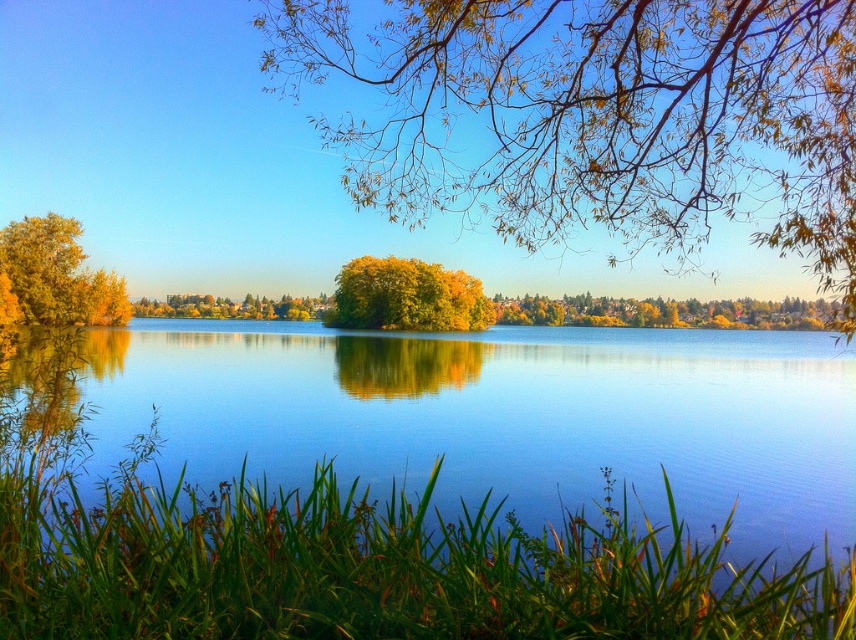
Question: Does green leafy grass at lower center appear over golden leafy tree at center?

Choices:
 (A) no
 (B) yes

Answer: (A)

Question: From the image, what is the correct spatial relationship of golden leafy tree at center in relation to golden yellow leaves at left?

Choices:
 (A) left
 (B) right

Answer: (B)

Question: Which point is closer to the camera?

Choices:
 (A) golden leafy tree at center
 (B) golden yellow leaves at left

Answer: (B)

Question: Among these points, which one is nearest to the camera?

Choices:
 (A) (42, 273)
 (B) (4, 516)
 (C) (423, 310)
 (D) (823, 124)

Answer: (B)

Question: Which point is closer to the camera taking this photo?

Choices:
 (A) (81, 301)
 (B) (452, 36)
 (C) (369, 256)
 (D) (424, 584)

Answer: (D)

Question: Observing the image, what is the correct spatial positioning of yellow-green foliage at center in reference to green leafy grass at lower center?

Choices:
 (A) right
 (B) left

Answer: (A)